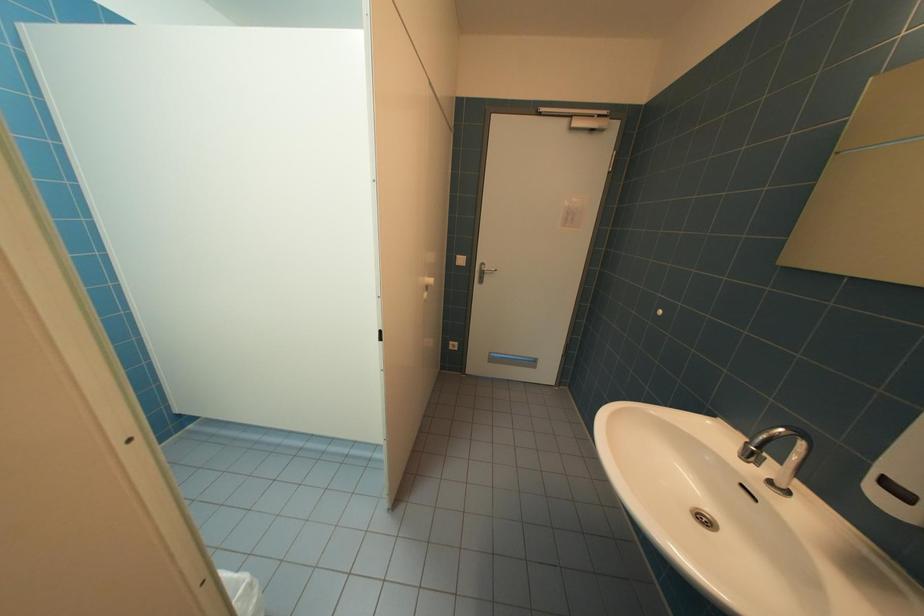
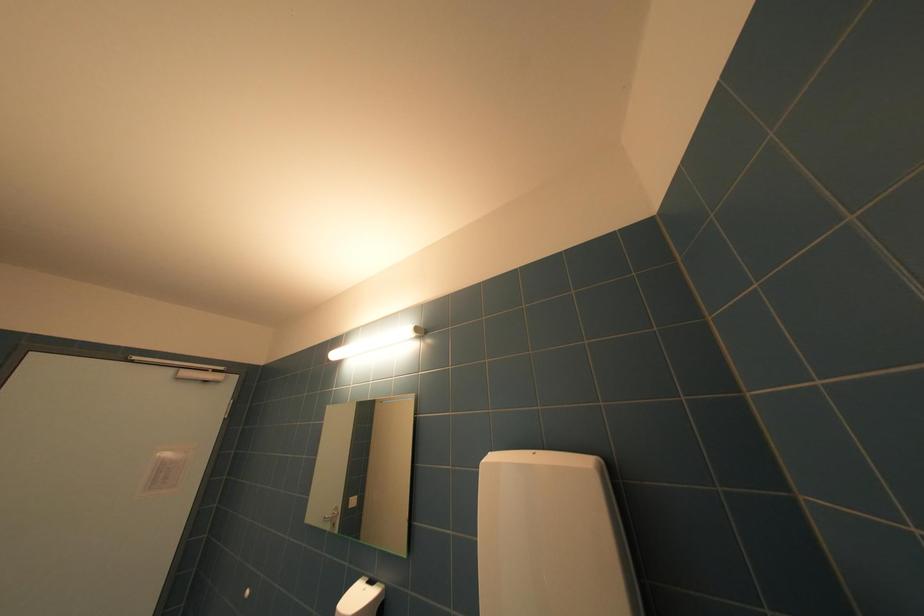
How did the camera likely rotate?

The rotation direction of the camera is right-up.